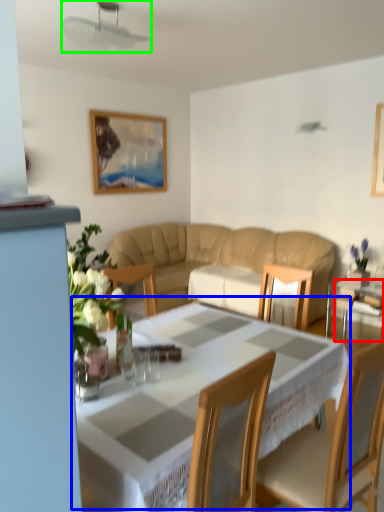
Question: Considering the real-world distances, which object is farthest from glass table (highlighted by a red box)? table (highlighted by a blue box) or fan (highlighted by a green box)?

Choices:
 (A) table
 (B) fan

Answer: (B)